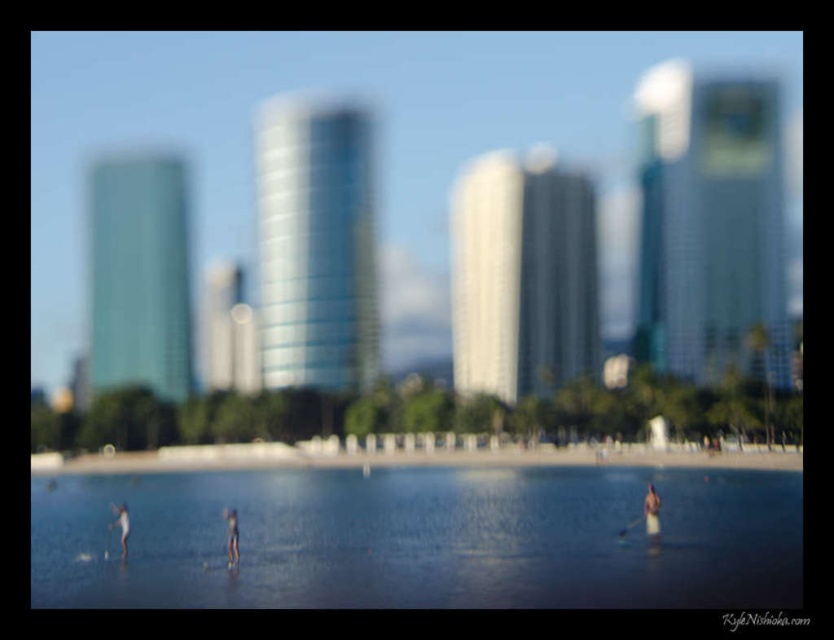
Question: Which of the following is the closest to the observer?

Choices:
 (A) (194, 516)
 (B) (143, 464)

Answer: (A)

Question: Can you confirm if clear water at center is positioned above smooth sand at lower center?

Choices:
 (A) no
 (B) yes

Answer: (B)

Question: Is clear water at center below smooth sand at lower center?

Choices:
 (A) yes
 (B) no

Answer: (B)

Question: Is clear water at center behind smooth sand at lower center?

Choices:
 (A) no
 (B) yes

Answer: (A)